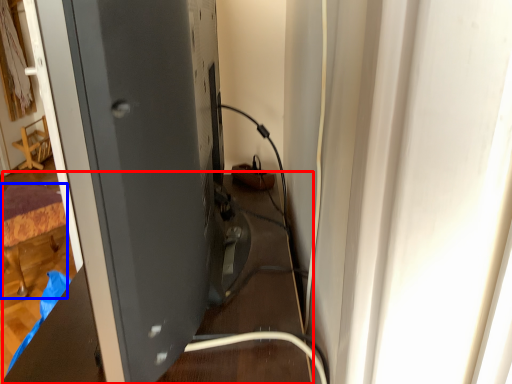
Question: Which point is further to the camera, table (highlighted by a red box) or furniture (highlighted by a blue box)?

Choices:
 (A) table
 (B) furniture

Answer: (B)